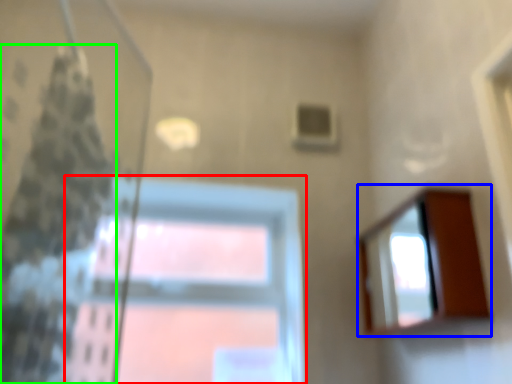
Question: Which object is the farthest from window (highlighted by a red box)? Choose among these: mirror (highlighted by a blue box) or shower curtain (highlighted by a green box).

Choices:
 (A) mirror
 (B) shower curtain

Answer: (A)